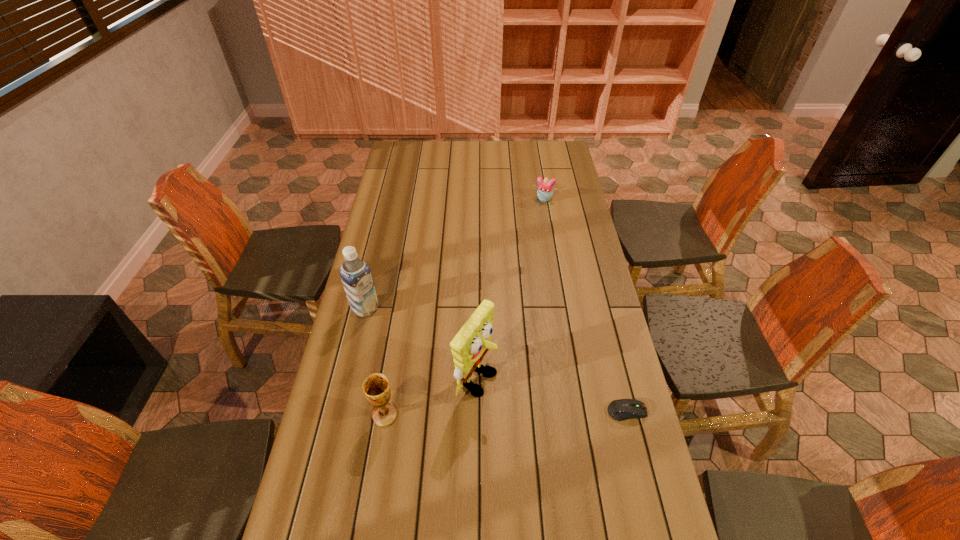
This screenshot has height=540, width=960. I want to click on vacant space positioned on the label of the leftmost object, so click(443, 361).

Locate an element on the screen. This screenshot has width=960, height=540. vacant space positioned on the label of the leftmost object is located at coordinates (387, 323).

Where is `vacant space located on the label of the leftmost object`? The height and width of the screenshot is (540, 960). vacant space located on the label of the leftmost object is located at coordinates (385, 322).

The image size is (960, 540). What are the coordinates of `blank area located on the face of the sponge` in the screenshot? It's located at (565, 428).

At what (x,y) coordinates should I click in order to perform the action: click on vacant point located on the face of the sponge. Please return your answer as a coordinate pair (x, y). Looking at the image, I should click on (617, 455).

Find the location of `free location located on the face of the sponge`. free location located on the face of the sponge is located at coordinates (534, 411).

At what (x,y) coordinates should I click in order to perform the action: click on free space located 0.250m on the face of the cupcake. Please return your answer as a coordinate pair (x, y). Image resolution: width=960 pixels, height=540 pixels. Looking at the image, I should click on (529, 239).

What are the coordinates of `vacant region located on the face of the cupcake` in the screenshot? It's located at (536, 218).

The height and width of the screenshot is (540, 960). What are the coordinates of `vacant space located 0.240m on the face of the cupcake` in the screenshot? It's located at (530, 237).

At what (x,y) coordinates should I click in order to perform the action: click on chalice located at the left edge. Please return your answer as a coordinate pair (x, y). Image resolution: width=960 pixels, height=540 pixels. Looking at the image, I should click on (376, 387).